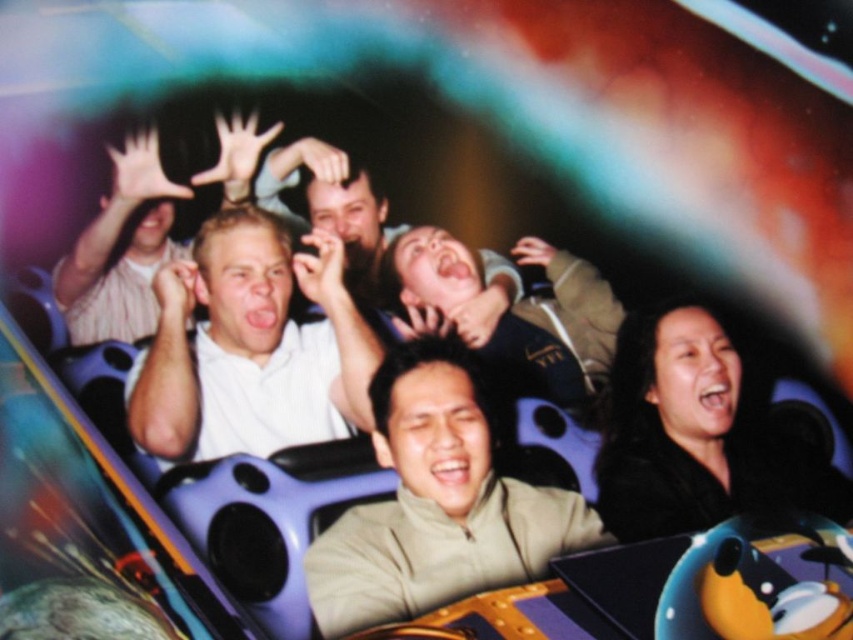
Question: Estimate the real-world distances between objects in this image. Which object is farther from the smooth skin face at center?

Choices:
 (A) matte khaki shirt at center
 (B) white matte shirt at center
 (C) tan matte jacket at center

Answer: (C)

Question: Is tan matte jacket at center bigger than matte khaki shirt at center?

Choices:
 (A) yes
 (B) no

Answer: (B)

Question: Which of these objects is positioned farthest from the smooth skin face at center?

Choices:
 (A) matte khaki shirt at center
 (B) tan matte jacket at center
 (C) white matte shirt at center

Answer: (B)

Question: Where is tan matte jacket at center located in relation to smooth skin face at center in the image?

Choices:
 (A) left
 (B) right

Answer: (B)

Question: Which object appears farthest from the camera in this image?

Choices:
 (A) white matte shirt at center
 (B) tan matte jacket at center
 (C) matte khaki shirt at center

Answer: (C)

Question: Can you confirm if matte khaki shirt at center is positioned to the right of smooth skin face at center?

Choices:
 (A) yes
 (B) no

Answer: (A)